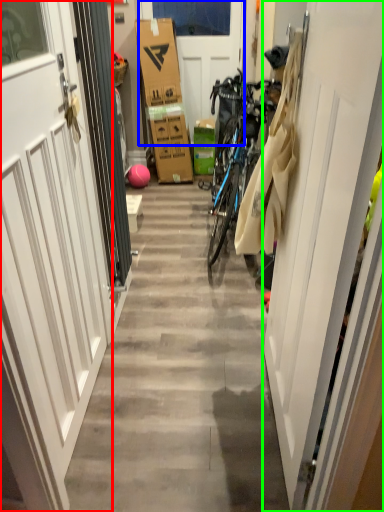
Question: Which object is positioned closest to door (highlighted by a red box)? Select from door (highlighted by a blue box) and door (highlighted by a green box).

Choices:
 (A) door
 (B) door

Answer: (B)